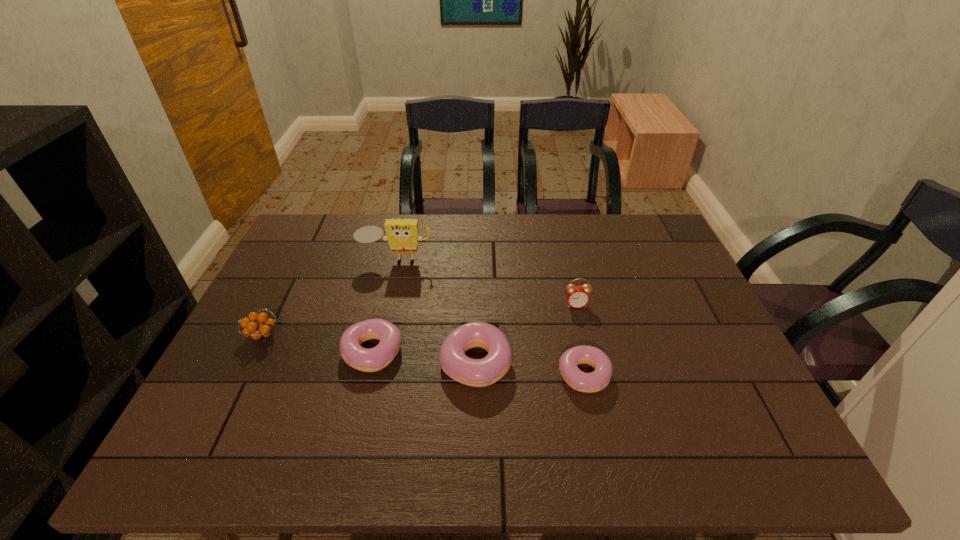
In order to click on the second shortest doughnut in this screenshot , I will do `click(374, 359)`.

You are a GUI agent. You are given a task and a screenshot of the screen. Output one action in this format:
    pyautogui.click(x=<x>, y=<y>)
    Task: Click on the second doughnut from right to left
    The height and width of the screenshot is (540, 960).
    Given the screenshot: What is the action you would take?
    pyautogui.click(x=483, y=372)

At what (x,y) coordinates should I click in order to perform the action: click on the shortest doughnut. Please return your answer as a coordinate pair (x, y). Looking at the image, I should click on (597, 380).

Locate an element on the screen. The image size is (960, 540). the rightmost doughnut is located at coordinates coord(597,380).

Locate an element on the screen. the farthest object is located at coordinates (402, 235).

The image size is (960, 540). I want to click on sponge, so click(402, 235).

The height and width of the screenshot is (540, 960). Find the location of `the second farthest object`. the second farthest object is located at coordinates (577, 297).

Find the location of a particular element. The image size is (960, 540). the fifth shortest object is located at coordinates (577, 297).

Image resolution: width=960 pixels, height=540 pixels. In order to click on the leftmost object in this screenshot , I will do `click(260, 330)`.

At what (x,y) coordinates should I click in order to perform the action: click on vacant area situated 0.060m on the left of the leftmost doughnut. Please return your answer as a coordinate pair (x, y). Looking at the image, I should click on (319, 352).